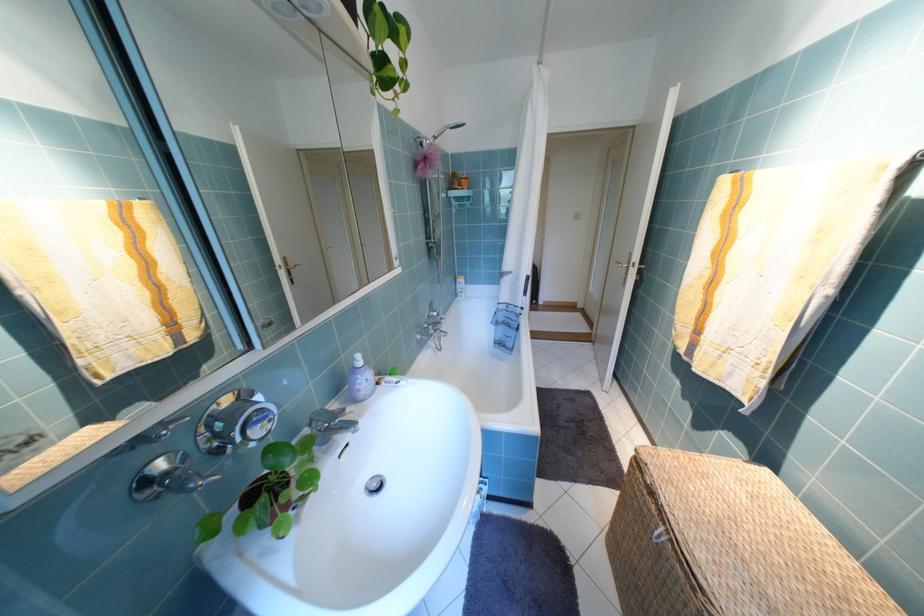
Where would you lift the basket lid loop? Please return your answer as a coordinate pair (x, y).

(658, 537)